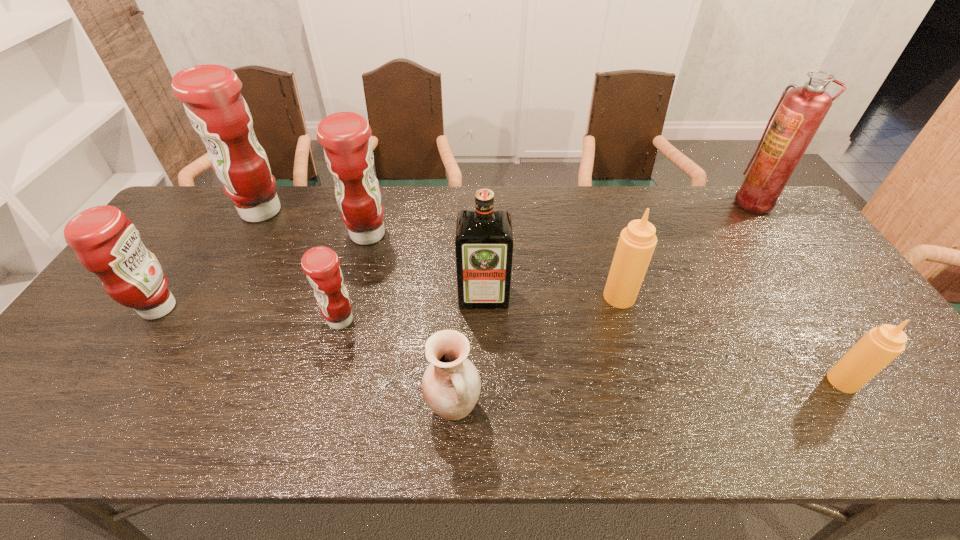
Locate an element on the screen. The height and width of the screenshot is (540, 960). the tallest condiment is located at coordinates (211, 94).

Find the location of a particular element. fire extinguisher is located at coordinates (801, 110).

Locate an element on the screen. This screenshot has width=960, height=540. the second tallest condiment is located at coordinates (348, 152).

Find the location of a particular element. This screenshot has height=540, width=960. liquor is located at coordinates (484, 238).

Where is `the third biggest red condiment`? The height and width of the screenshot is (540, 960). the third biggest red condiment is located at coordinates (106, 243).

Where is `the bigger tan condiment`? The height and width of the screenshot is (540, 960). the bigger tan condiment is located at coordinates (636, 244).

What are the coordinates of `the left tan condiment` in the screenshot? It's located at point(636,244).

Locate an element on the screen. the right tan condiment is located at coordinates (881, 345).

Find the location of `the nearer tan condiment`. the nearer tan condiment is located at coordinates (881, 345).

Find the location of a particular element. This screenshot has height=540, width=960. the smallest red condiment is located at coordinates (320, 264).